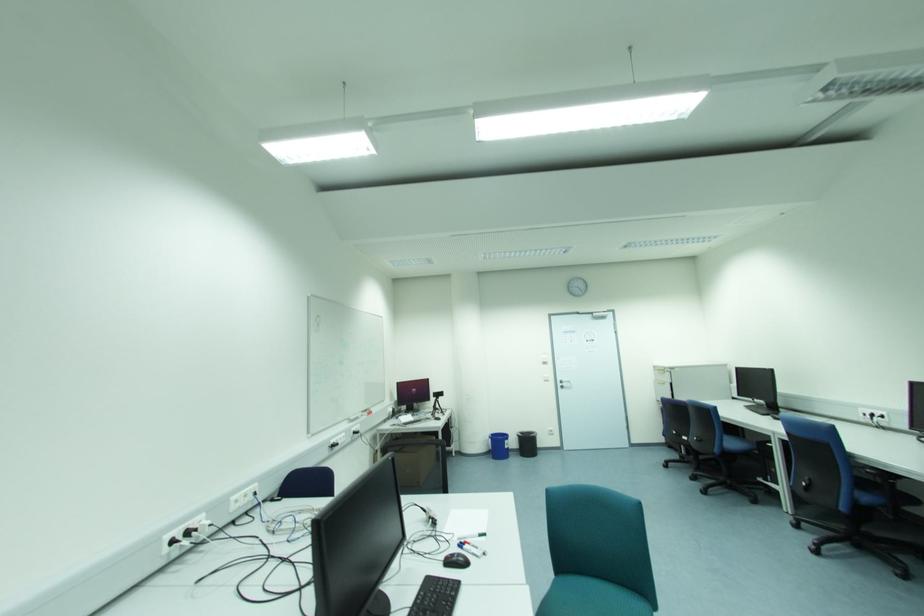
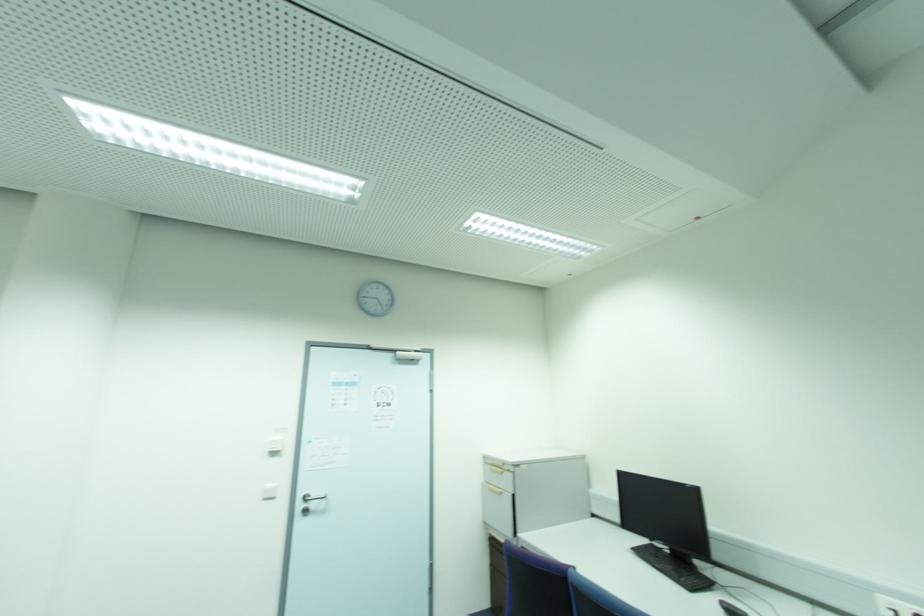
The point at (562, 382) is marked in the first image. Where is the corresponding point in the second image?

(306, 500)